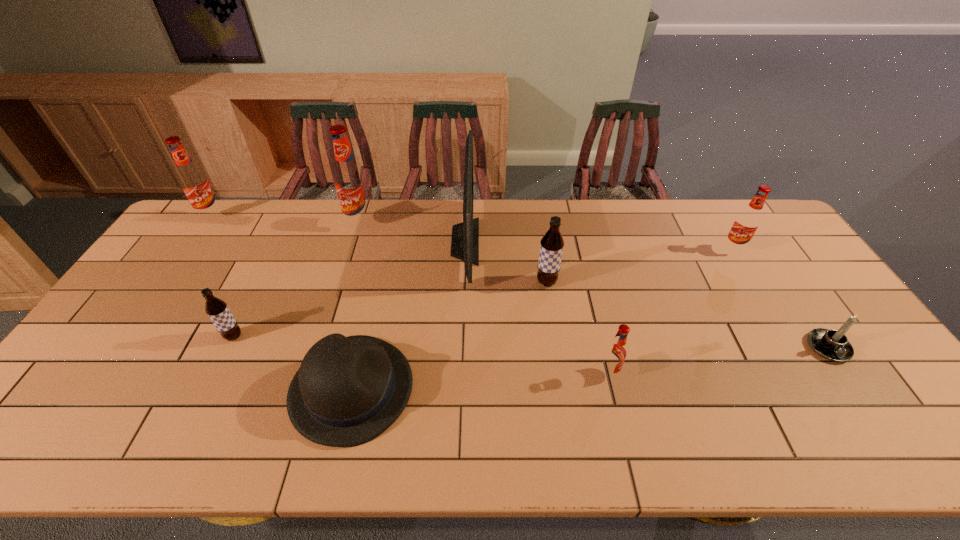
Where is `object present at the far left corner`? The image size is (960, 540). object present at the far left corner is located at coordinates (195, 184).

In the image, there is a desktop. Where is `vacant space at the far edge`? The height and width of the screenshot is (540, 960). vacant space at the far edge is located at coordinates tap(630, 242).

Locate an element on the screen. The image size is (960, 540). free point at the near edge is located at coordinates (731, 422).

This screenshot has height=540, width=960. What are the coordinates of `vacant space at the left edge of the desktop` in the screenshot? It's located at (173, 267).

This screenshot has width=960, height=540. What are the coordinates of `vacant position at the far left corner of the desktop` in the screenshot? It's located at (240, 205).

You are a GUI agent. You are given a task and a screenshot of the screen. Output one action in this format:
    pyautogui.click(x=<x>, y=<y>)
    Task: Click on the vacant point at the near right corner
    
    Given the screenshot: What is the action you would take?
    pyautogui.click(x=908, y=425)

Where is `vacant area that lies between the third farthest red root beer and the fifth object from right to left`? The image size is (960, 540). vacant area that lies between the third farthest red root beer and the fifth object from right to left is located at coordinates (599, 246).

The height and width of the screenshot is (540, 960). Identify the location of free space between the leftmost root beer and the second root beer from left to right. (223, 276).

Image resolution: width=960 pixels, height=540 pixels. I want to click on vacant space that is in between the fifth object from left to right and the farther brown root beer, so click(x=506, y=262).

Locate an element on the screen. The width and height of the screenshot is (960, 540). blank region between the candle holder and the fifth object from left to right is located at coordinates (646, 295).